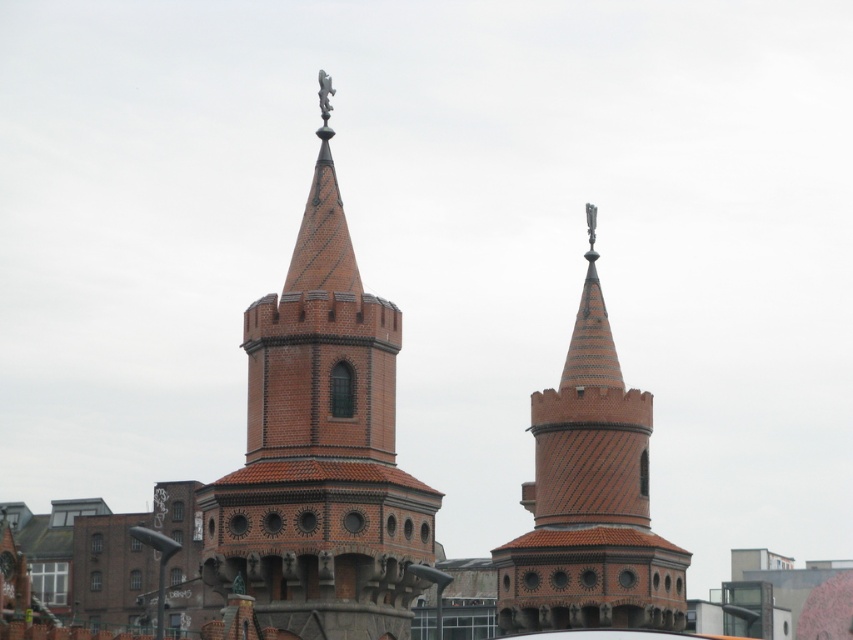
Question: Is brown brick tower at center to the right of brown textured brick tower at center from the viewer's perspective?

Choices:
 (A) no
 (B) yes

Answer: (A)

Question: Where is brown brick tower at center located in relation to brown textured brick tower at center in the image?

Choices:
 (A) above
 (B) below

Answer: (A)

Question: Does brown brick tower at center have a smaller size compared to brown textured brick tower at center?

Choices:
 (A) no
 (B) yes

Answer: (A)

Question: Which point appears farthest from the camera in this image?

Choices:
 (A) (277, 582)
 (B) (605, 465)

Answer: (B)